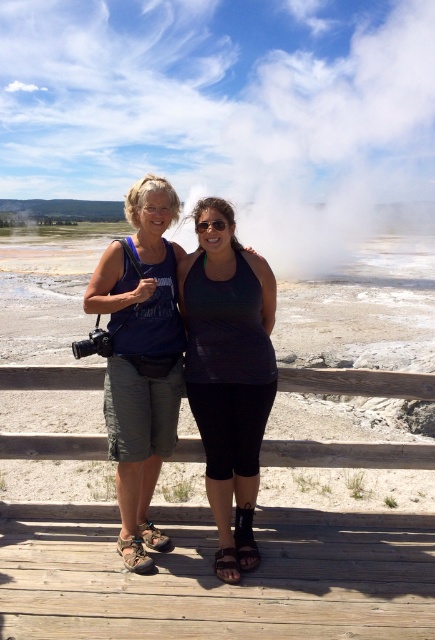
Question: Among these points, which one is farthest from the camera?

Choices:
 (A) (260, 260)
 (B) (391, 131)
 (C) (220, 227)
 (D) (100, 260)

Answer: (B)

Question: Which point appears closest to the camera in this image?

Choices:
 (A) (233, 381)
 (B) (204, 227)
 (C) (377, 61)
 (D) (129, 532)

Answer: (A)

Question: Is the position of white vapor at center more distant than that of matte black tank top at center?

Choices:
 (A) yes
 (B) no

Answer: (A)

Question: Which object appears closest to the camera in this image?

Choices:
 (A) black matte sunglasses at center
 (B) matte blue tank top at center
 (C) white vapor at center

Answer: (B)

Question: Does white vapor at center appear on the left side of matte blue tank top at center?

Choices:
 (A) yes
 (B) no

Answer: (B)

Question: Can you confirm if matte blue tank top at center is smaller than black matte sunglasses at center?

Choices:
 (A) yes
 (B) no

Answer: (B)